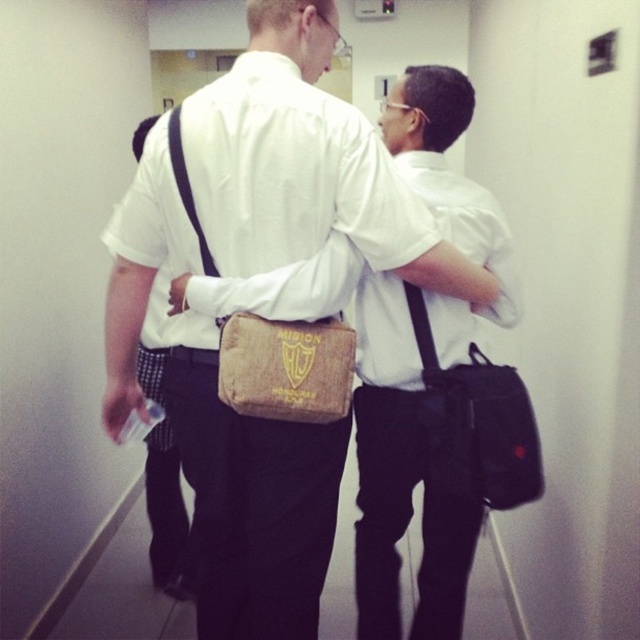
You are standing in the hallway and see the white woven bag at center. Where exactly is it located in terms of coordinates?

The white woven bag at center is located at coordinates point [291,172].

You are a security guard in a school and need to check the bags of two students walking down the hallway. The students are carrying a brown canvas bag at center and a white woven bag at center. Which bag should you check first if you want to check the taller bag first?

The brown canvas bag at center is much taller than the white woven bag at center, so you should check the brown canvas bag at center first.